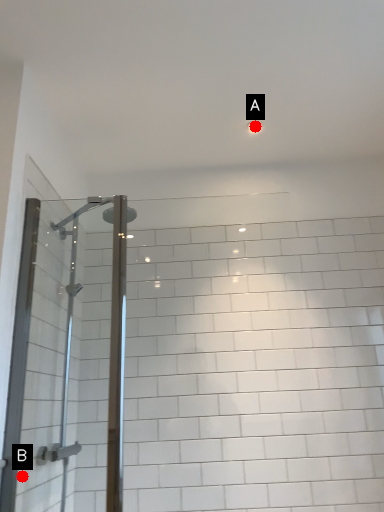
Question: Two points are circled on the image, labeled by A and B beside each circle. Which point is further to the camera?

Choices:
 (A) A is further
 (B) B is further

Answer: (A)